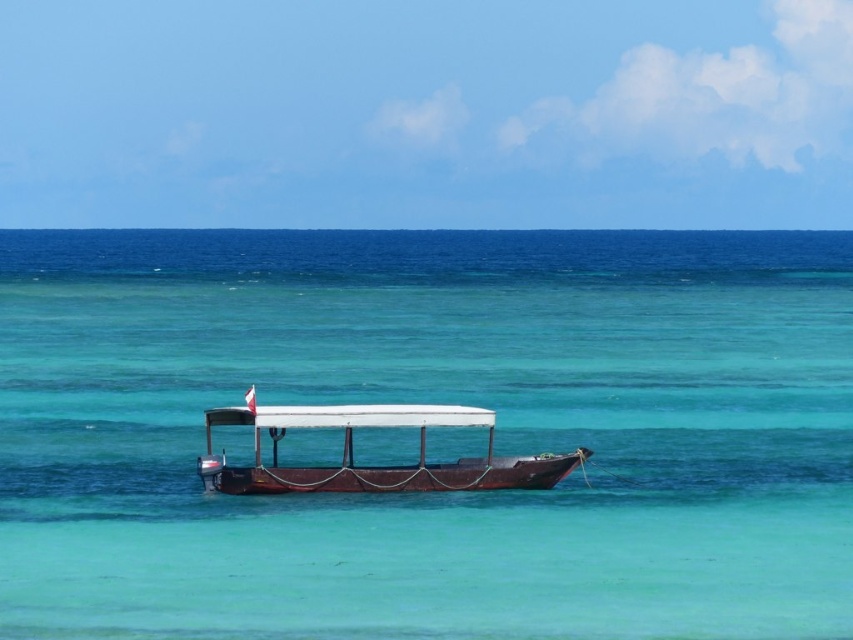
You are standing on the shore looking out at the seascape. Which object, the clear turquoise water at center or the wooden boat at center, is closer to you?

The clear turquoise water at center is closer to you than the wooden boat at center.

You are standing on the deck of the boat and want to reach both the point labeled point (724, 540) and the point labeled point (407, 481). Which point should you reach first to minimize the distance walked?

You should reach point (724, 540) first because it is closer to you than point (407, 481), so walking to it first requires less distance.